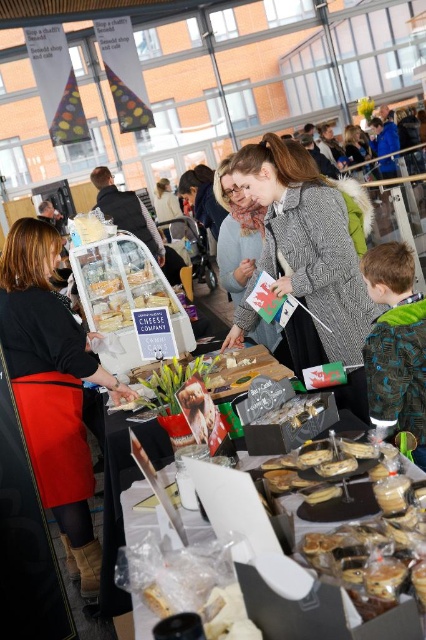
Does matte black apron at left have a smaller size compared to clear plastic table at center?

Incorrect, matte black apron at left is not smaller in size than clear plastic table at center.

Can you confirm if matte black apron at left is positioned to the left of clear plastic table at center?

Indeed, matte black apron at left is positioned on the left side of clear plastic table at center.

Locate an element on the screen. matte black apron at left is located at coordinates (52, 387).

Is point (132, 289) less distant than point (327, 492)?

That is False.

Measure the distance between point (100, 308) and camera.

A distance of 3.35 meters exists between point (100, 308) and camera.

Is point (152, 264) farther from camera compared to point (328, 499)?

Yes, point (152, 264) is farther from viewer.

Find the location of `translucent plastic cheese at center`. translucent plastic cheese at center is located at coordinates (120, 291).

Is the position of clear plastic table at center more distant than that of golden brown pastry at center?

No, clear plastic table at center is closer to the viewer.

Is clear plastic table at center smaller than golden brown pastry at center?

Incorrect, clear plastic table at center is not smaller in size than golden brown pastry at center.

Between point (146, 525) and point (316, 500), which one is positioned in front?

Point (316, 500)

Identify the location of clear plastic table at center. Image resolution: width=426 pixels, height=640 pixels. (138, 512).